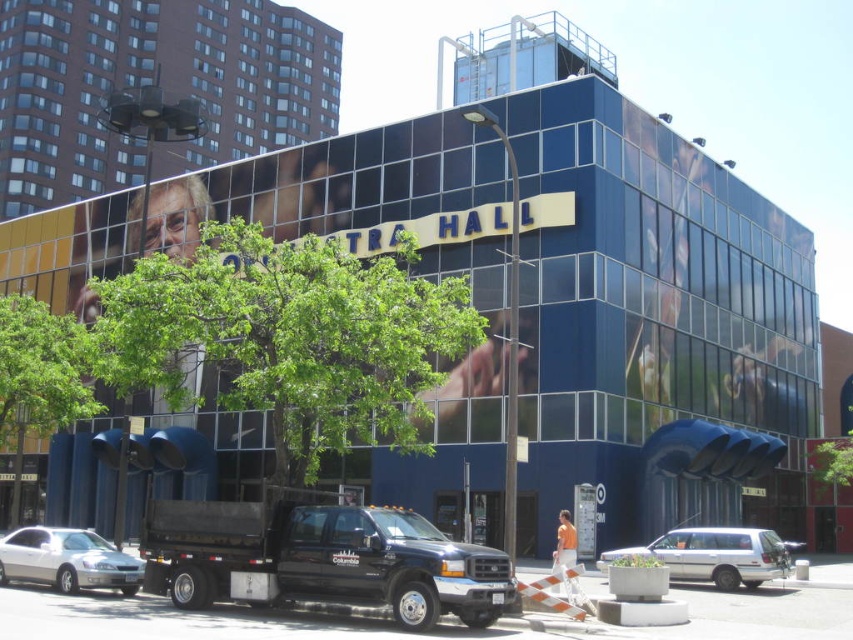
Question: Which is farther from the green leafy tree at center?

Choices:
 (A) green leafy tree at lower left
 (B) white matte minivan at lower right
 (C) silver metallic sedan at lower left

Answer: (B)

Question: Which object is closer to the camera taking this photo?

Choices:
 (A) silver metallic sedan at lower left
 (B) green leafy tree at lower left
 (C) green leafy tree at center
 (D) white matte minivan at lower right

Answer: (C)

Question: Estimate the real-world distances between objects in this image. Which object is closer to the green leafy tree at lower left?

Choices:
 (A) green leafy tree at center
 (B) silver metallic sedan at lower left
 (C) white matte minivan at lower right

Answer: (A)

Question: From the image, what is the correct spatial relationship of green leafy tree at center in relation to silver metallic sedan at lower left?

Choices:
 (A) left
 (B) right

Answer: (B)

Question: Does green leafy tree at center have a lesser width compared to silver metallic sedan at lower left?

Choices:
 (A) yes
 (B) no

Answer: (B)

Question: Can you confirm if green leafy tree at center is thinner than silver metallic sedan at lower left?

Choices:
 (A) no
 (B) yes

Answer: (A)